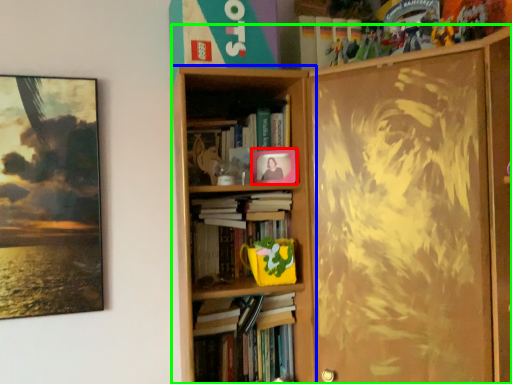
Question: Based on their relative distances, which object is nearer to picture frame (highlighted by a red box)? Choose from bookcase (highlighted by a blue box) and bookcase (highlighted by a green box).

Choices:
 (A) bookcase
 (B) bookcase

Answer: (A)